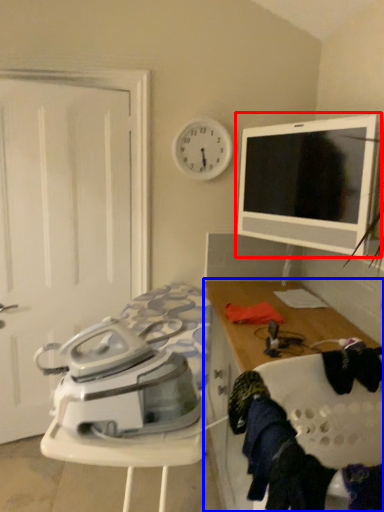
Question: Among these objects, which one is nearest to the camera, tableware (highlighted by a red box) or cabinetry (highlighted by a blue box)?

Choices:
 (A) tableware
 (B) cabinetry

Answer: (B)